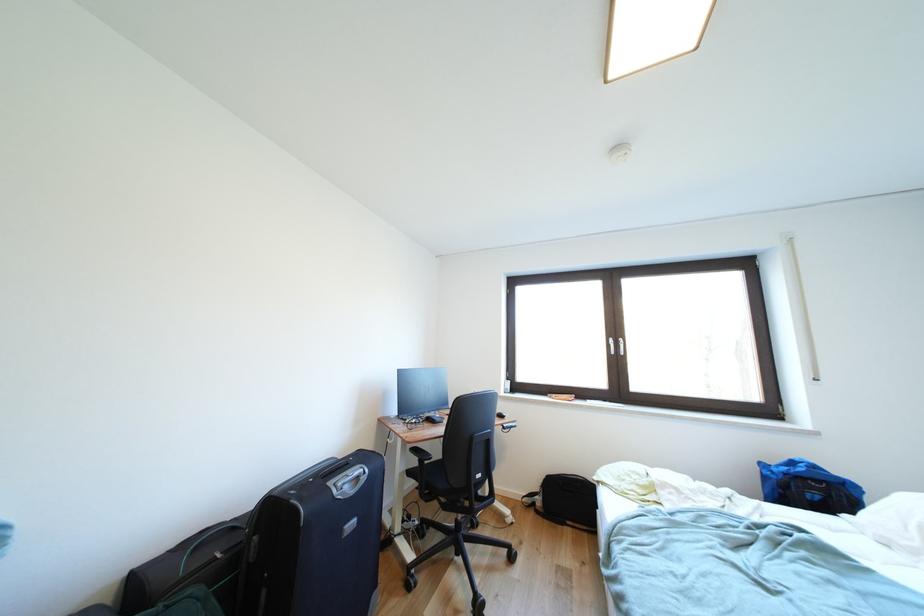
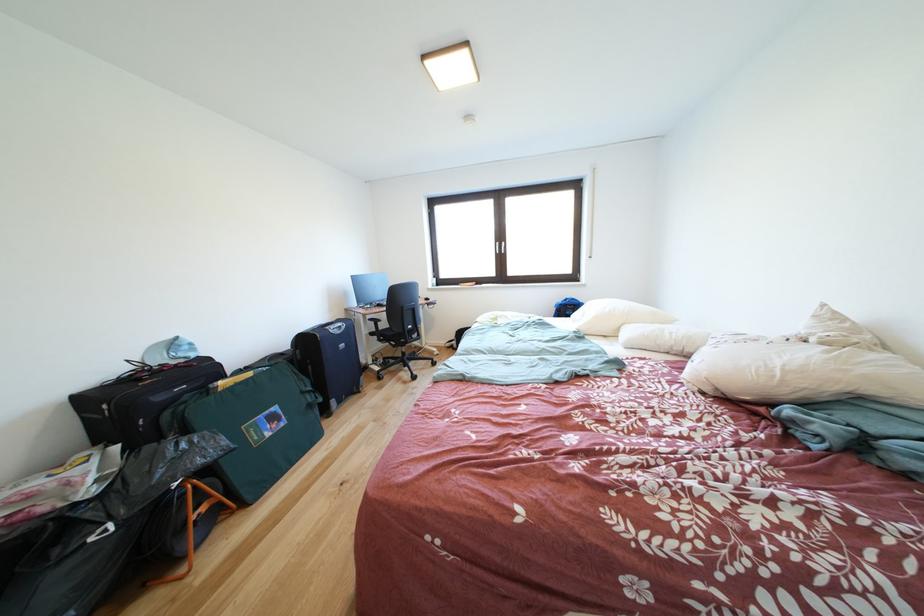
In the second image, find the point that corresponds to (x=454, y=512) in the first image.

(403, 351)